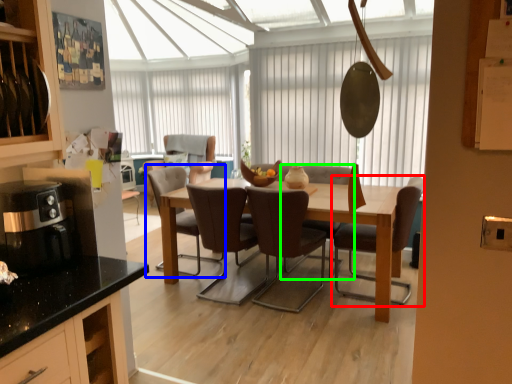
Question: Based on their relative distances, which object is nearer to chair (highlighted by a red box)? Choose from chair (highlighted by a blue box) and chair (highlighted by a green box).

Choices:
 (A) chair
 (B) chair

Answer: (B)